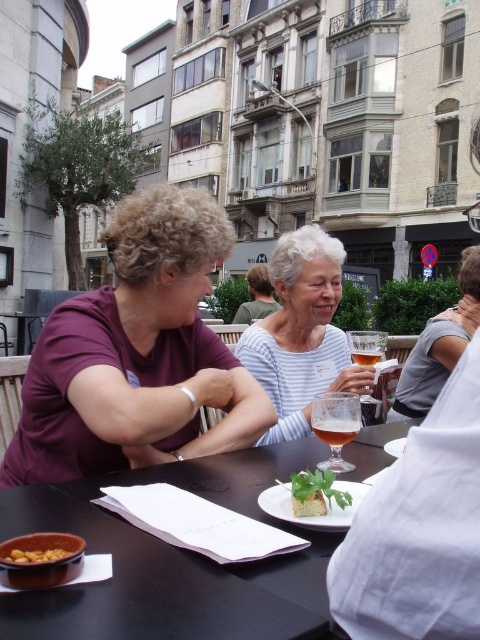
You are standing at the viewpoint of the image and want to know which of the two points, point (34,576) or point (374,349), is closer to you. Based on the scene, can you determine this?

Point (34,576) is in front of point (374,349), so it is closer to you.

You are taking a photo of the two points in the image. The camera is positioned at your eye level. Which point, point (95, 636) or point (368, 364), is closer to the camera?

Point (95, 636) is closer to the camera than point (368, 364).

You are a customer at the outdoor table and want to grab the green leafy garnish at center. Which direction should you reach towards relative to the purple matte shirt at left?

The purple matte shirt at left is to the left of green leafy garnish at center, so you should reach to the right of the purple matte shirt at left to grab the green leafy garnish at center.